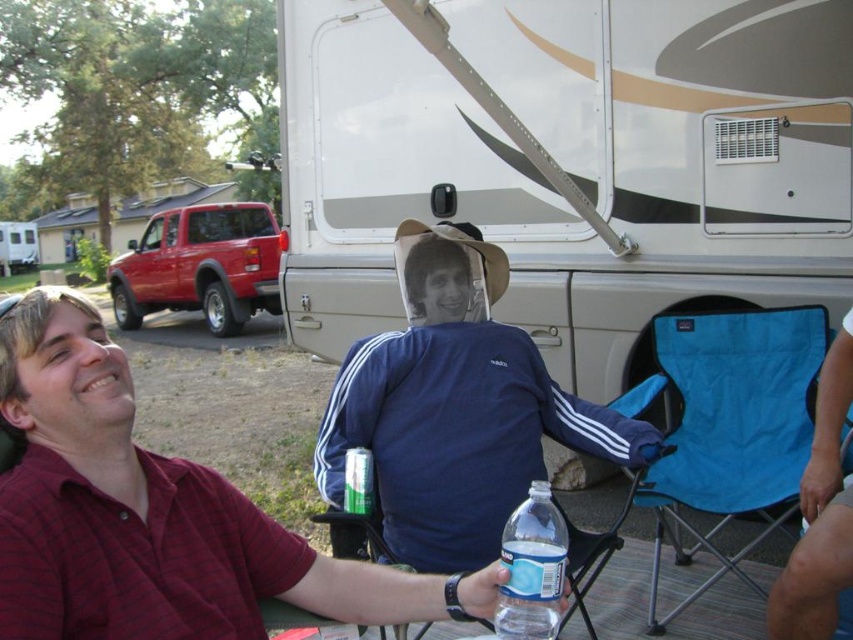
You are standing at the campsite and want to know the distance between the maroon cotton shirt at lower left and the metallic red truck at left. Can you estimate how far apart they are?

The maroon cotton shirt at lower left is 9.70 meters away from the metallic red truck at left.

You are standing in the campsite and notice the maroon cotton shirt at lower left and the metallic red truck at left. Which object is taller?

The maroon cotton shirt at lower left is taller than the metallic red truck at left.

Please provide the 2D coordinates of the maroon cotton shirt at lower left in the image. The coordinates should be in the format of a point with two decimal places, like point x, y.

The 2D coordinates of the maroon cotton shirt at lower left are point [154,515].